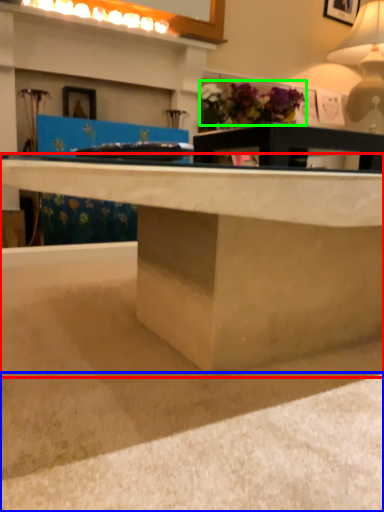
Question: Considering the real-world distances, which object is farthest from desk (highlighted by a red box)? concrete (highlighted by a blue box) or flower (highlighted by a green box)?

Choices:
 (A) concrete
 (B) flower

Answer: (B)